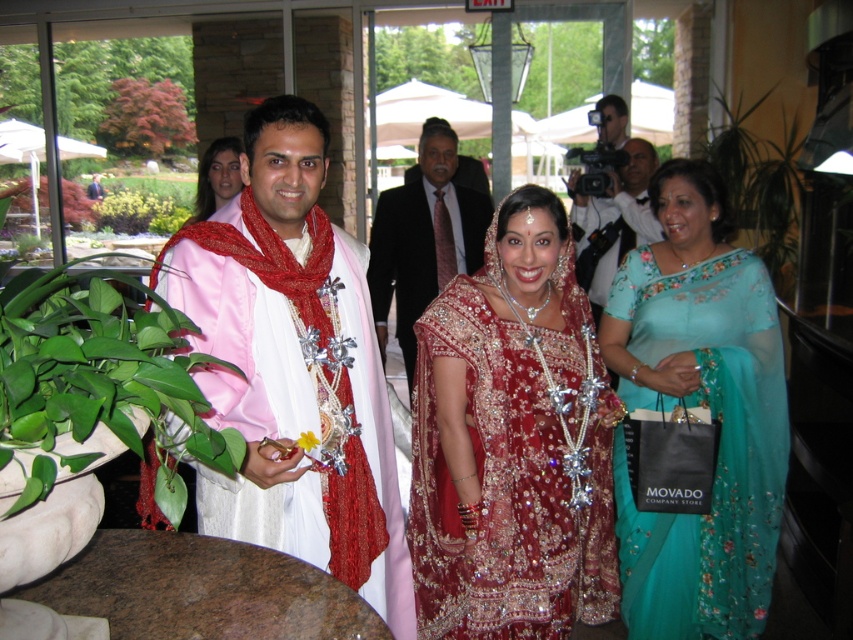
Question: Does dark suit at center appear over matte black camera at center?

Choices:
 (A) yes
 (B) no

Answer: (B)

Question: Among these points, which one is nearest to the camera?

Choices:
 (A) (602, 195)
 (B) (503, 570)

Answer: (B)

Question: Is dark suit at center positioned before matte black camera at center?

Choices:
 (A) no
 (B) yes

Answer: (B)

Question: Does matte black camera at center have a greater width compared to matte pink saree at center?

Choices:
 (A) no
 (B) yes

Answer: (B)

Question: Estimate the real-world distances between objects in this image. Which object is farther from the teal floral saree at right?

Choices:
 (A) matte pink fabric at center
 (B) dark suit at center
 (C) matte pink saree at center
 (D) matte black camera at center

Answer: (C)

Question: Which point is farther to the camera?

Choices:
 (A) (612, 186)
 (B) (718, 349)
 (C) (724, 276)
 (D) (413, 237)

Answer: (A)